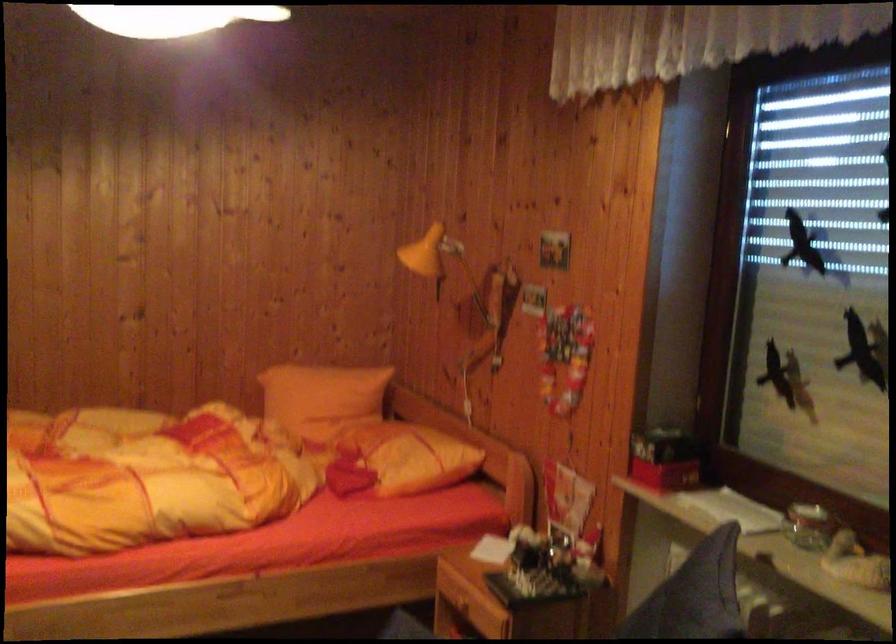
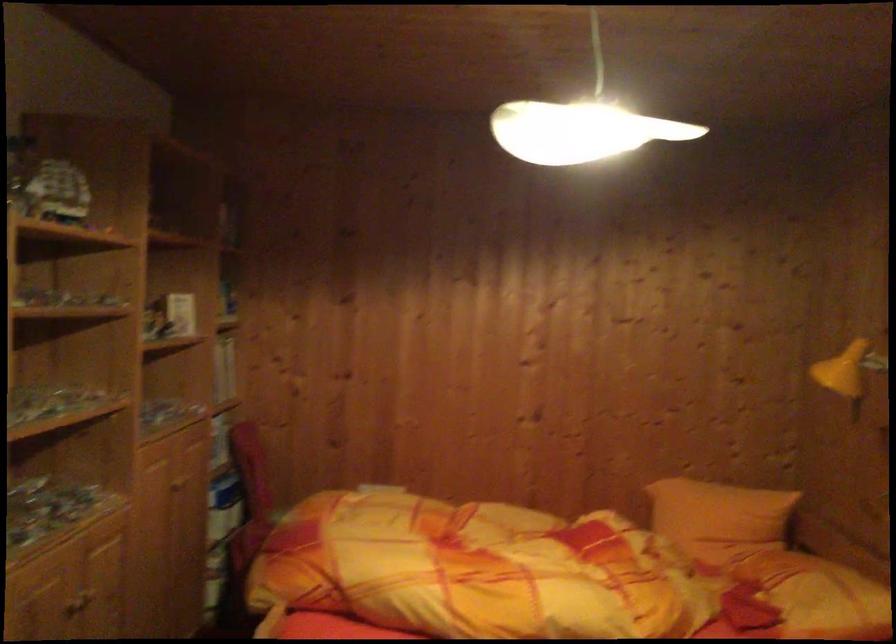
Question: In a continuous first-person perspective shot, in which direction is the camera moving?

Choices:
 (A) Left
 (B) Right
 (C) Forward
 (D) Backward

Answer: (A)